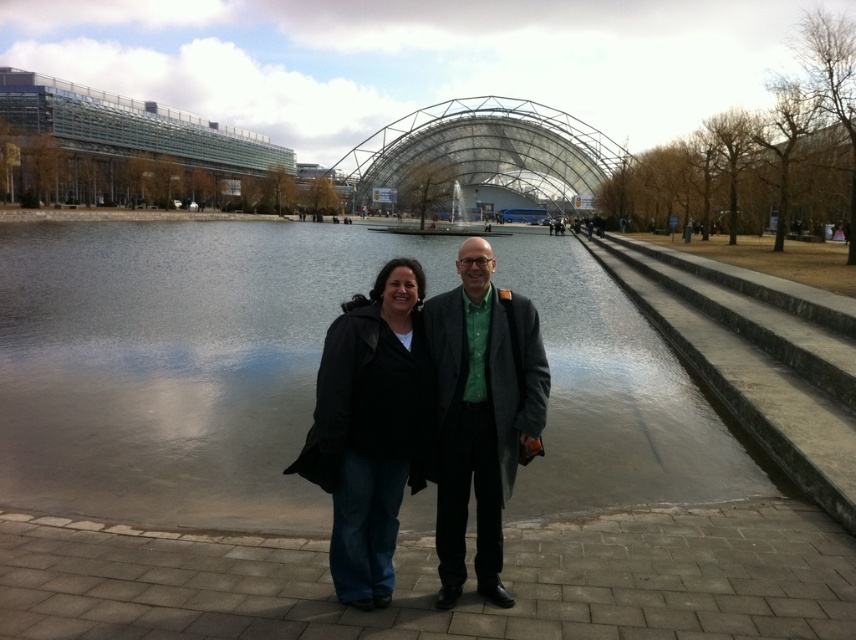
Question: Based on their relative distances, which object is nearer to the black leather jacket at center?

Choices:
 (A) matte gray coat at center
 (B) smooth concrete water at center

Answer: (A)

Question: Which point is closer to the camera?

Choices:
 (A) (464, 529)
 (B) (572, 342)

Answer: (A)

Question: Does smooth concrete water at center have a smaller size compared to matte gray coat at center?

Choices:
 (A) yes
 (B) no

Answer: (B)

Question: Does smooth concrete water at center lie behind black leather jacket at center?

Choices:
 (A) no
 (B) yes

Answer: (B)

Question: Can you confirm if smooth concrete water at center is bigger than matte gray coat at center?

Choices:
 (A) no
 (B) yes

Answer: (B)

Question: Which point is closer to the camera?

Choices:
 (A) (452, 404)
 (B) (271, 506)
 (C) (370, 545)

Answer: (C)